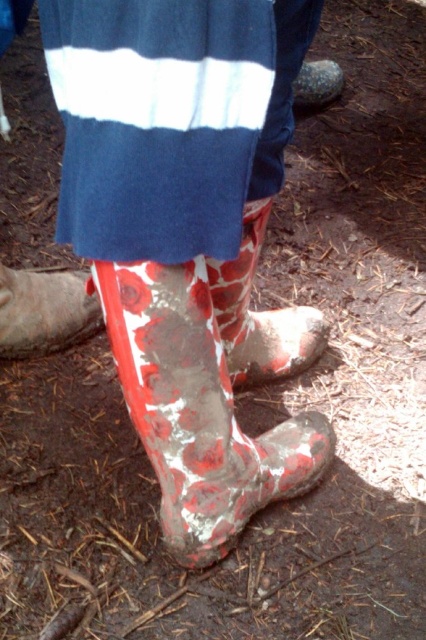
Question: Which object is closer to the camera taking this photo?

Choices:
 (A) shiny metallic rock at upper center
 (B) matte rubber boot at lower left
 (C) rubber boot at lower center
 (D) reddish matte rubber boot at lower center

Answer: (C)

Question: Can you confirm if reddish matte rubber boot at lower center is positioned below shiny metallic rock at upper center?

Choices:
 (A) yes
 (B) no

Answer: (A)

Question: Is rubber boot at lower center in front of shiny metallic rock at upper center?

Choices:
 (A) yes
 (B) no

Answer: (A)

Question: Based on their relative distances, which object is nearer to the shiny metallic rock at upper center?

Choices:
 (A) rubber boot at lower center
 (B) matte rubber boot at lower left
 (C) reddish matte rubber boot at lower center

Answer: (C)

Question: Among these points, which one is nearest to the camera?

Choices:
 (A) (161, 288)
 (B) (238, 305)
 (C) (2, 305)

Answer: (A)

Question: Is rubber boot at lower center wider than shiny metallic rock at upper center?

Choices:
 (A) yes
 (B) no

Answer: (A)